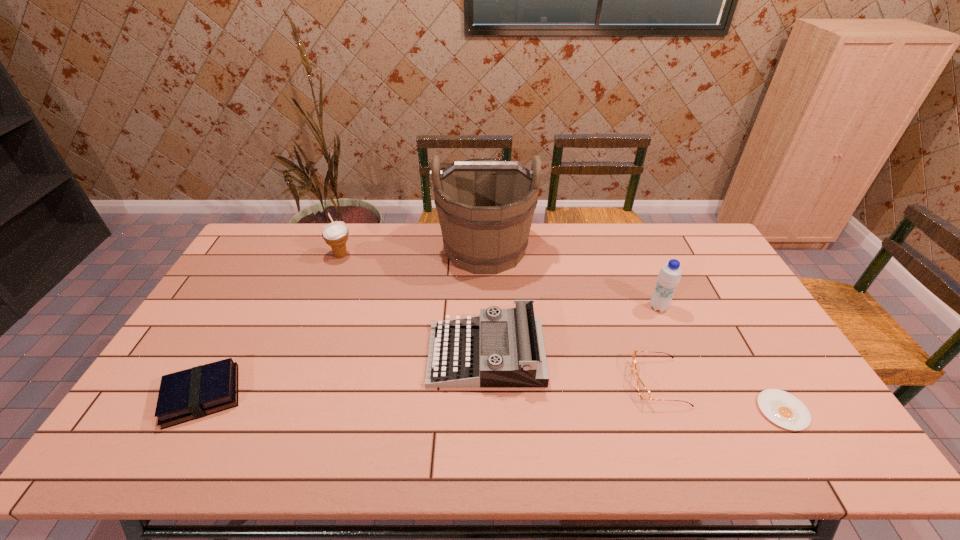
This screenshot has height=540, width=960. In order to click on bucket in this screenshot , I will do `click(485, 207)`.

Where is `the fifth nearest object`? This screenshot has height=540, width=960. the fifth nearest object is located at coordinates (669, 276).

Identify the location of the sixth object from right to left. (335, 234).

Find the location of a particular element. This screenshot has height=540, width=960. icecream is located at coordinates (335, 234).

The height and width of the screenshot is (540, 960). I want to click on typewriter, so click(x=501, y=348).

At what (x,y) coordinates should I click in order to perform the action: click on spectacles. Please return your answer as a coordinate pair (x, y). The height and width of the screenshot is (540, 960). Looking at the image, I should click on (642, 390).

I want to click on book, so click(190, 394).

Identify the location of the rightmost object. This screenshot has height=540, width=960. (782, 408).

Identify the location of the shortest object. (782, 408).

Where is `free space located on the right of the tallest object`? This screenshot has height=540, width=960. free space located on the right of the tallest object is located at coordinates tap(589, 249).